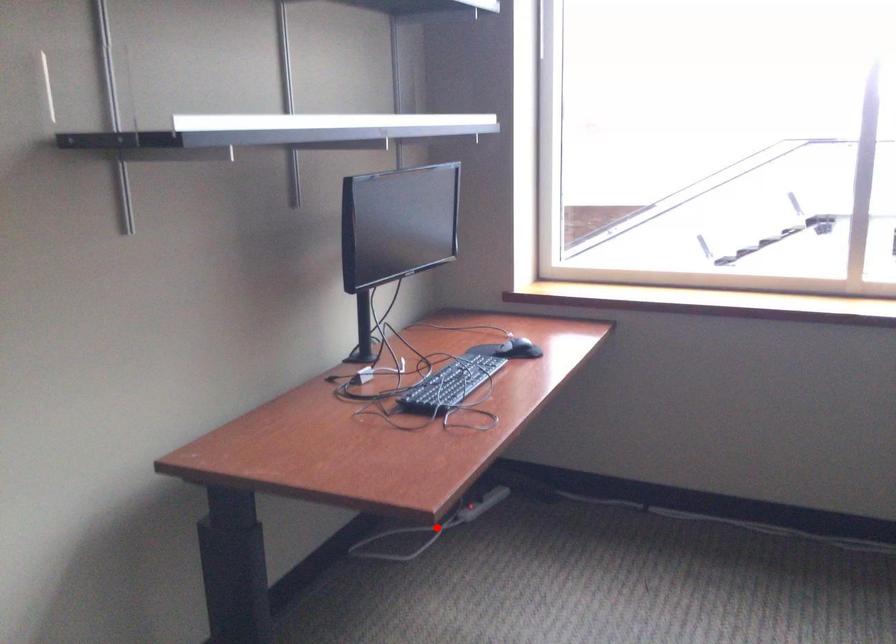
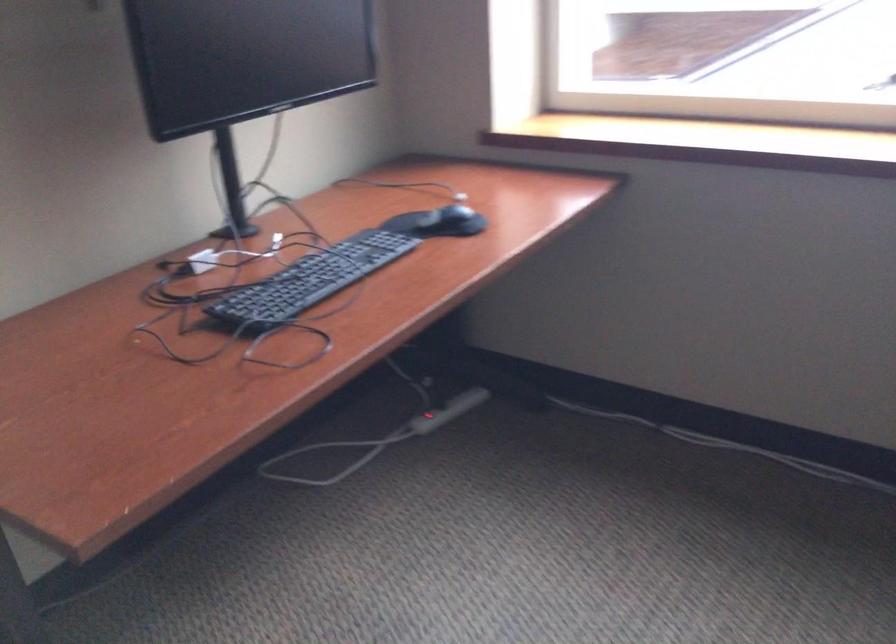
Question: I am providing you with two images of the same scene from different viewpoints. In image1, a red point is highlighted. Considering the same 3D point in image2, which of the following is correct?

Choices:
 (A) It is closer
 (B) It is farther

Answer: (A)